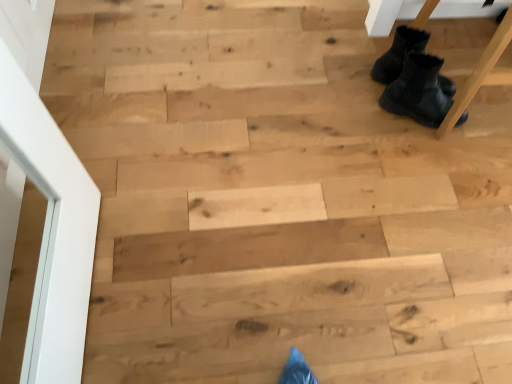
Describe the element at coordinates (418, 91) in the screenshot. This screenshot has height=384, width=512. I see `black fuzzy boots at upper right, arranged as the 2th footwear when viewed from the top` at that location.

How much space does black fuzzy boots at upper right, positioned as the 1th footwear in bottom-to-top order, occupy vertically?

black fuzzy boots at upper right, positioned as the 1th footwear in bottom-to-top order, is 8.84 inches tall.

This screenshot has width=512, height=384. In order to click on black fuzzy boots at upper right, arranged as the 2th footwear when viewed from the top in this screenshot , I will do `click(418, 91)`.

Where is `black suede boots at upper right, placed as the second footwear when sorted from bottom to top`? The width and height of the screenshot is (512, 384). black suede boots at upper right, placed as the second footwear when sorted from bottom to top is located at coordinates (398, 53).

What do you see at coordinates (398, 53) in the screenshot? I see `black suede boots at upper right, the 1th footwear from the top` at bounding box center [398, 53].

Where is `black fuzzy boots at upper right, arranged as the 2th footwear when viewed from the top`? black fuzzy boots at upper right, arranged as the 2th footwear when viewed from the top is located at coordinates (418, 91).

In the scene shown: Considering the positions of objects black fuzzy boots at upper right, positioned as the 1th footwear in bottom-to-top order, and black suede boots at upper right, the 1th footwear from the top, in the image provided, who is more to the right, black fuzzy boots at upper right, positioned as the 1th footwear in bottom-to-top order, or black suede boots at upper right, the 1th footwear from the top,?

black fuzzy boots at upper right, positioned as the 1th footwear in bottom-to-top order.

Which is behind, black fuzzy boots at upper right, arranged as the 2th footwear when viewed from the top, or black suede boots at upper right, the 1th footwear from the top?

black suede boots at upper right, the 1th footwear from the top, is behind.

Does point (430, 119) appear closer or farther from the camera than point (420, 48)?

Point (430, 119) appears to be farther away from the viewer than point (420, 48).

From the image's perspective, who appears lower, black fuzzy boots at upper right, arranged as the 2th footwear when viewed from the top, or black suede boots at upper right, placed as the second footwear when sorted from bottom to top?

From the image's view, black fuzzy boots at upper right, arranged as the 2th footwear when viewed from the top, is below.

Looking at this image, from a real-world perspective, does black fuzzy boots at upper right, arranged as the 2th footwear when viewed from the top, sit lower than black suede boots at upper right, placed as the second footwear when sorted from bottom to top?

Yes, from a real-world perspective, black fuzzy boots at upper right, arranged as the 2th footwear when viewed from the top, is below black suede boots at upper right, placed as the second footwear when sorted from bottom to top.

Which object is thinner, black fuzzy boots at upper right, positioned as the 1th footwear in bottom-to-top order, or black suede boots at upper right, the 1th footwear from the top?

With smaller width is black suede boots at upper right, the 1th footwear from the top.

Who is shorter, black fuzzy boots at upper right, positioned as the 1th footwear in bottom-to-top order, or black suede boots at upper right, the 1th footwear from the top?

black suede boots at upper right, the 1th footwear from the top.

Which of these two, black fuzzy boots at upper right, arranged as the 2th footwear when viewed from the top, or black suede boots at upper right, placed as the second footwear when sorted from bottom to top, is smaller?

black suede boots at upper right, placed as the second footwear when sorted from bottom to top.

Is black fuzzy boots at upper right, positioned as the 1th footwear in bottom-to-top order, situated inside black suede boots at upper right, placed as the second footwear when sorted from bottom to top, or outside?

black fuzzy boots at upper right, positioned as the 1th footwear in bottom-to-top order, is located beyond the bounds of black suede boots at upper right, placed as the second footwear when sorted from bottom to top.

Is black fuzzy boots at upper right, positioned as the 1th footwear in bottom-to-top order, far from black suede boots at upper right, the 1th footwear from the top?

No, black fuzzy boots at upper right, positioned as the 1th footwear in bottom-to-top order, is in close proximity to black suede boots at upper right, the 1th footwear from the top.

Is black fuzzy boots at upper right, positioned as the 1th footwear in bottom-to-top order, facing towards black suede boots at upper right, the 1th footwear from the top?

No, black fuzzy boots at upper right, positioned as the 1th footwear in bottom-to-top order, does not turn towards black suede boots at upper right, the 1th footwear from the top.

Where is `footwear on the left of black fuzzy boots at upper right, positioned as the 1th footwear in bottom-to-top order`? footwear on the left of black fuzzy boots at upper right, positioned as the 1th footwear in bottom-to-top order is located at coordinates (398, 53).

Considering the positions of objects black suede boots at upper right, the 1th footwear from the top, and black fuzzy boots at upper right, positioned as the 1th footwear in bottom-to-top order, in the image provided, who is more to the right, black suede boots at upper right, the 1th footwear from the top, or black fuzzy boots at upper right, positioned as the 1th footwear in bottom-to-top order,?

Positioned to the right is black fuzzy boots at upper right, positioned as the 1th footwear in bottom-to-top order.

Does black suede boots at upper right, placed as the second footwear when sorted from bottom to top, lie behind black fuzzy boots at upper right, positioned as the 1th footwear in bottom-to-top order?

Yes.

Between point (407, 53) and point (417, 80), which one is positioned in front?

The point (417, 80) is more forward.

From the image's perspective, is black suede boots at upper right, the 1th footwear from the top, on black fuzzy boots at upper right, positioned as the 1th footwear in bottom-to-top order?

Yes, from the image's perspective, black suede boots at upper right, the 1th footwear from the top, is on top of black fuzzy boots at upper right, positioned as the 1th footwear in bottom-to-top order.

From a real-world perspective, between black suede boots at upper right, the 1th footwear from the top, and black fuzzy boots at upper right, arranged as the 2th footwear when viewed from the top, who is vertically higher?

In real-world perspective, black suede boots at upper right, the 1th footwear from the top, is above.

Which of these two, black suede boots at upper right, the 1th footwear from the top, or black fuzzy boots at upper right, positioned as the 1th footwear in bottom-to-top order, is wider?

black fuzzy boots at upper right, positioned as the 1th footwear in bottom-to-top order.

Who is shorter, black suede boots at upper right, the 1th footwear from the top, or black fuzzy boots at upper right, arranged as the 2th footwear when viewed from the top?

black suede boots at upper right, the 1th footwear from the top, is shorter.

Considering the relative sizes of black suede boots at upper right, placed as the second footwear when sorted from bottom to top, and black fuzzy boots at upper right, arranged as the 2th footwear when viewed from the top, in the image provided, is black suede boots at upper right, placed as the second footwear when sorted from bottom to top, bigger than black fuzzy boots at upper right, arranged as the 2th footwear when viewed from the top,?

Incorrect, black suede boots at upper right, placed as the second footwear when sorted from bottom to top, is not larger than black fuzzy boots at upper right, arranged as the 2th footwear when viewed from the top.

Can black fuzzy boots at upper right, arranged as the 2th footwear when viewed from the top, be found inside black suede boots at upper right, the 1th footwear from the top?

No, black fuzzy boots at upper right, arranged as the 2th footwear when viewed from the top, is not surrounded by black suede boots at upper right, the 1th footwear from the top.

Is there a large distance between black suede boots at upper right, placed as the second footwear when sorted from bottom to top, and black fuzzy boots at upper right, positioned as the 1th footwear in bottom-to-top order?

No, black suede boots at upper right, placed as the second footwear when sorted from bottom to top, is in close proximity to black fuzzy boots at upper right, positioned as the 1th footwear in bottom-to-top order.

Does black suede boots at upper right, the 1th footwear from the top, turn towards black fuzzy boots at upper right, positioned as the 1th footwear in bottom-to-top order?

No, black suede boots at upper right, the 1th footwear from the top, is not facing towards black fuzzy boots at upper right, positioned as the 1th footwear in bottom-to-top order.

How much distance is there between black suede boots at upper right, placed as the second footwear when sorted from bottom to top, and black fuzzy boots at upper right, positioned as the 1th footwear in bottom-to-top order?

5.31 centimeters.

In order to click on footwear that appears behind the black fuzzy boots at upper right, arranged as the 2th footwear when viewed from the top in this screenshot , I will do `click(398, 53)`.

Where is `footwear in front of the black suede boots at upper right, the 1th footwear from the top`? footwear in front of the black suede boots at upper right, the 1th footwear from the top is located at coordinates (418, 91).

At what (x,y) coordinates should I click in order to perform the action: click on footwear above the black fuzzy boots at upper right, arranged as the 2th footwear when viewed from the top (from the image's perspective). Please return your answer as a coordinate pair (x, y). This screenshot has height=384, width=512. Looking at the image, I should click on (398, 53).